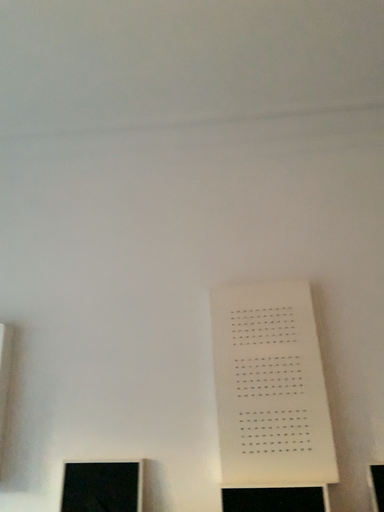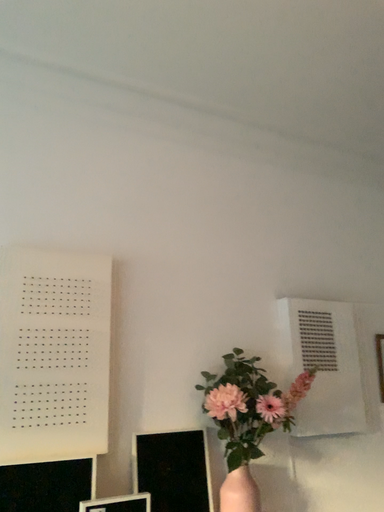
Question: Which way did the camera rotate in the video?

Choices:
 (A) rotated upward
 (B) rotated downward

Answer: (B)